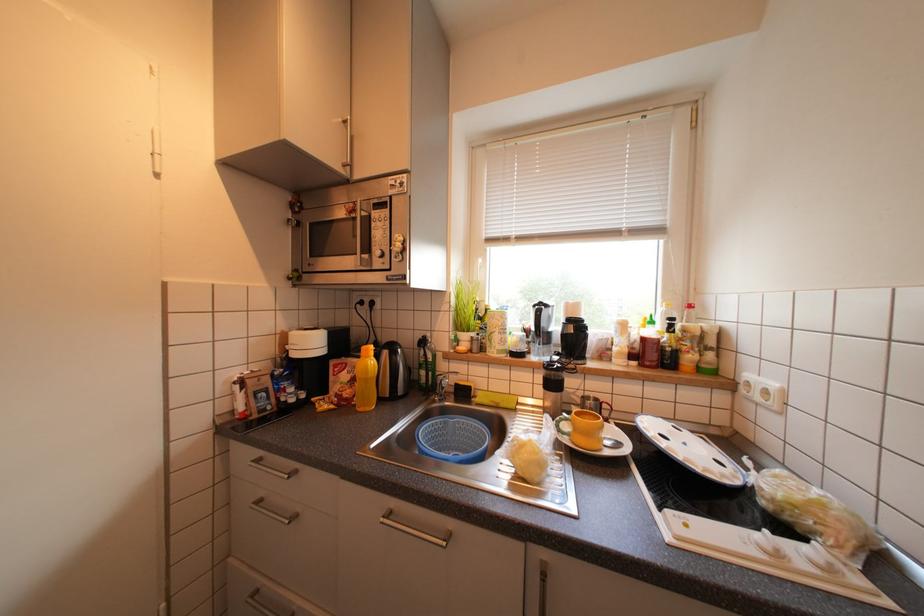
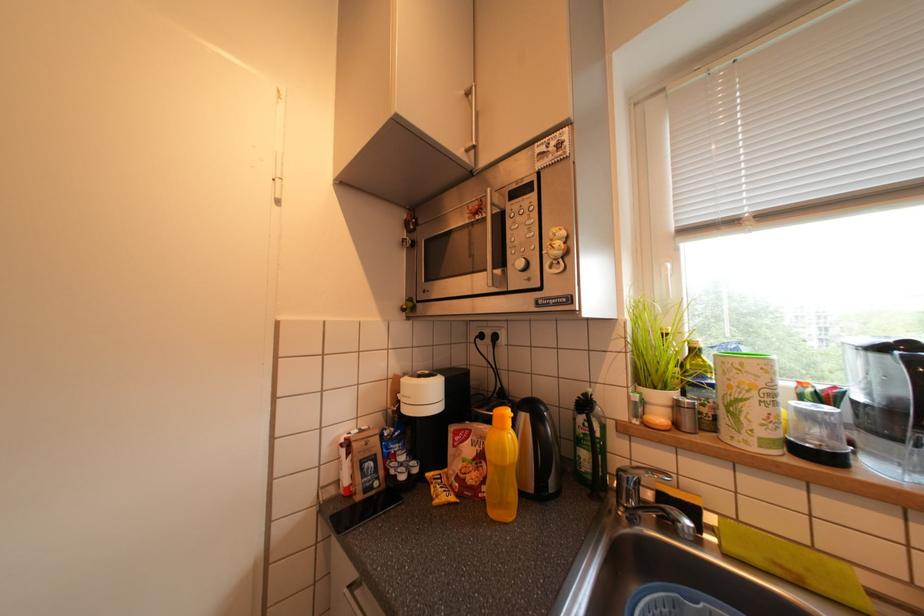
The images are taken continuously from a first-person perspective. In which direction are you moving?

The cameraman moved toward left, forward.